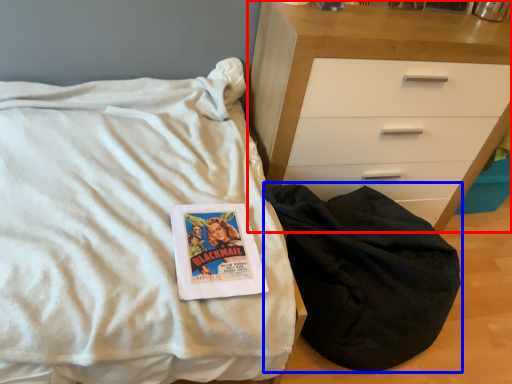
Question: Which of the following is the farthest to the observer, chest of drawers (highlighted by a red box) or sleeping bag (highlighted by a blue box)?

Choices:
 (A) chest of drawers
 (B) sleeping bag

Answer: (A)